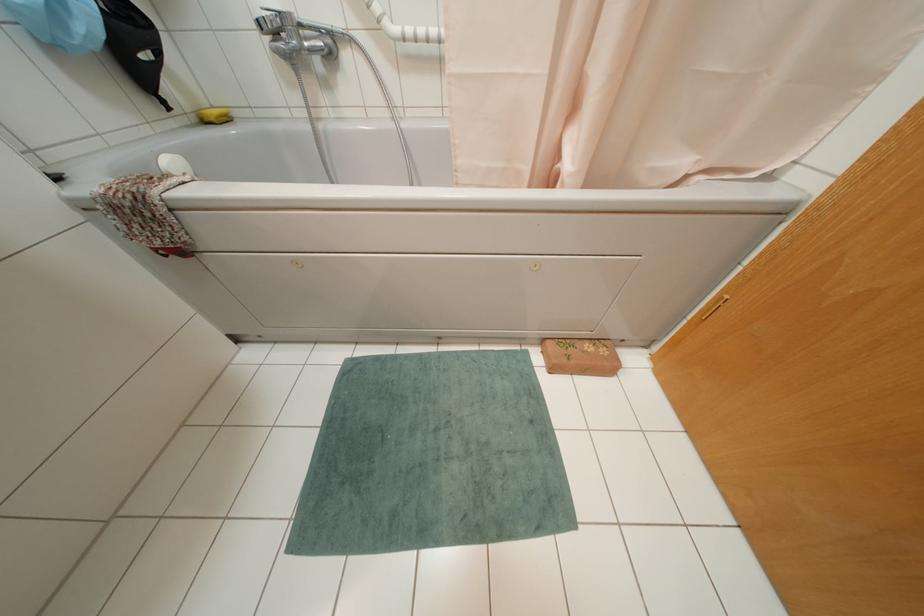
Find where to turn the chrome faucet handle. Please return your answer as a coordinate pair (x, y).

(272, 7)